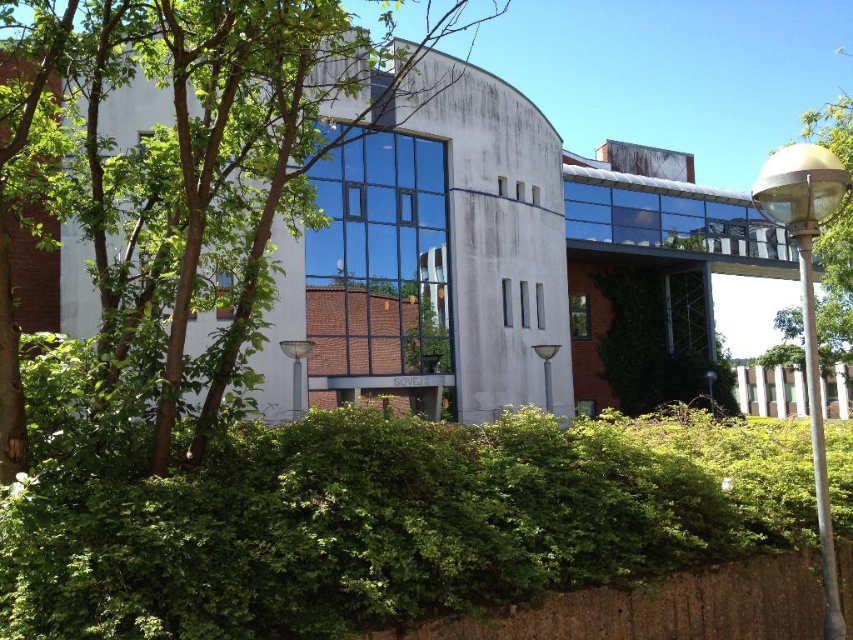
You are a landscape architect reviewing the building design. You notice both the green leafy hedge at center and the green leafy tree at center in the scene. Which of these two plants is positioned lower in the image?

The green leafy hedge at center is positioned lower than the green leafy tree at center in the image.

You are a gardener assessing the plants in front of the modern building. Which of the two green leafy plants, the green leafy hedge at center or the green leafy tree at center, requires more frequent pruning to maintain its current height?

The green leafy hedge at center requires more frequent pruning to maintain its current height because it is not as tall as the green leafy tree at center.

You are a landscape architect designing a garden path between the green leafy hedge at center and the green leafy tree at center. Which one has a narrower width to consider for the path spacing?

The green leafy hedge at center is thinner than the green leafy tree at center, so the path should be spaced closer to the hedge to accommodate the tree.